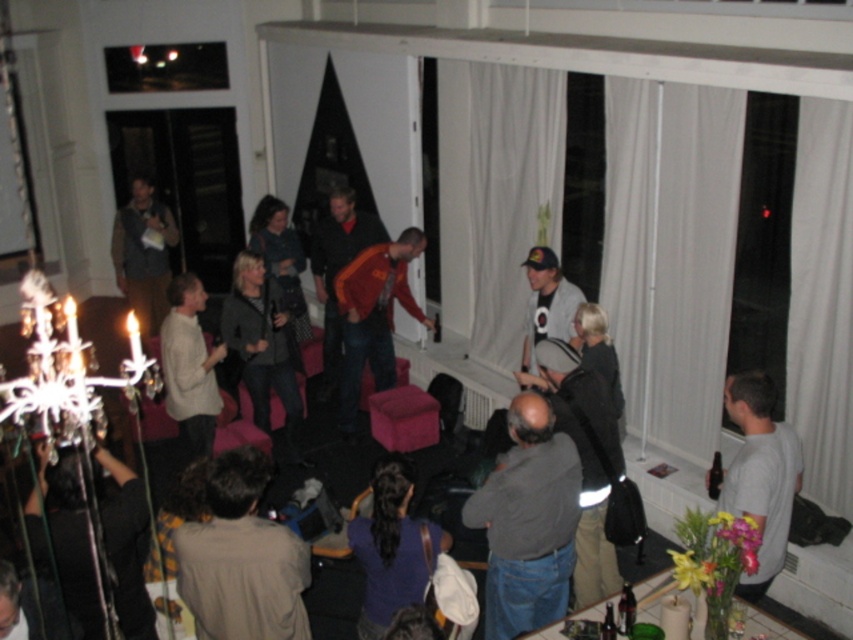
Does gray cotton t-shirt at right have a larger size compared to orange fabric jacket at center?

Incorrect, gray cotton t-shirt at right is not larger than orange fabric jacket at center.

This screenshot has height=640, width=853. Describe the element at coordinates (759, 474) in the screenshot. I see `gray cotton t-shirt at right` at that location.

This screenshot has height=640, width=853. Describe the element at coordinates (759, 474) in the screenshot. I see `gray cotton t-shirt at right` at that location.

Find the location of a particular element. This screenshot has height=640, width=853. gray cotton t-shirt at right is located at coordinates (759, 474).

Looking at this image, measure the distance between gray cotton t-shirt at right and camera.

gray cotton t-shirt at right is 3.39 meters from camera.

Is point (761, 445) positioned after point (183, 326)?

No, it is not.

Between point (781, 563) and point (194, 433), which one is positioned behind?

The point (194, 433) is more distant.

Locate an element on the screen. gray cotton t-shirt at right is located at coordinates (759, 474).

Who is taller, orange fabric jacket at center or white cotton t-shirt at center?

Standing taller between the two is orange fabric jacket at center.

Where is `orange fabric jacket at center`? The height and width of the screenshot is (640, 853). orange fabric jacket at center is located at coordinates (338, 268).

Where is `orange fabric jacket at center`? The width and height of the screenshot is (853, 640). orange fabric jacket at center is located at coordinates pos(338,268).

The width and height of the screenshot is (853, 640). Identify the location of orange fabric jacket at center. (338, 268).